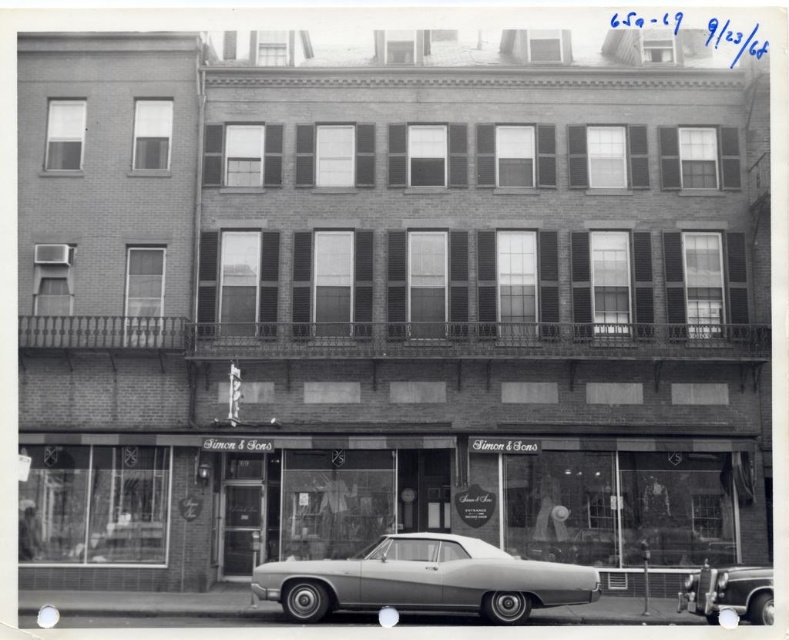
You are standing in front of the building and want to enter the glass storefront at center. Based on its 2D location coordinates, can you estimate where exactly the entrance is located relative to the building?

The glass storefront at center is located at coordinates point (380, 506), which means it is positioned slightly to the right and near the middle of the building facade.

You are standing on the sidewalk in front of the building and see the glass storefront at center and the shiny silver sedan at center. Which object is positioned to the left from your perspective?

The glass storefront at center is to the left of the shiny silver sedan at center from your perspective.